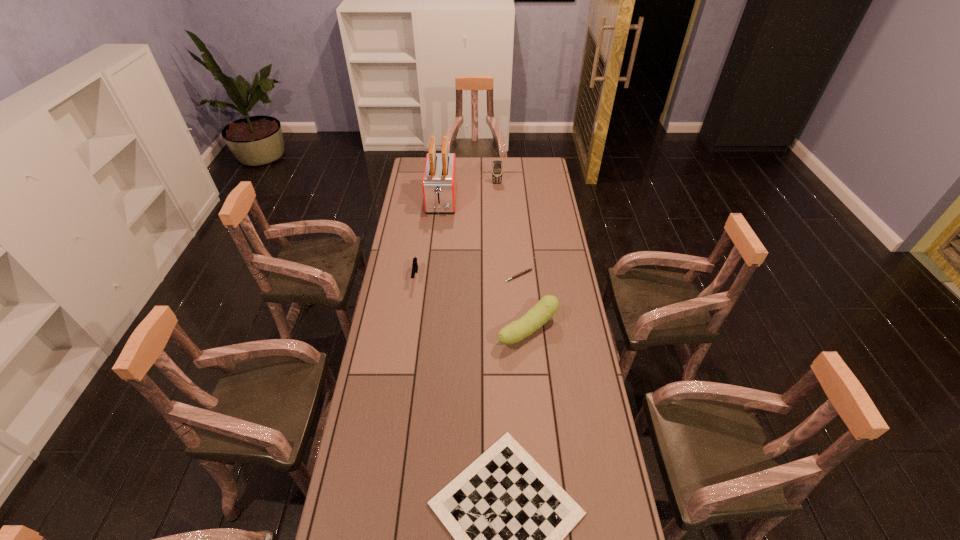
Image resolution: width=960 pixels, height=540 pixels. What are the coordinates of `empty location between the pen and the cucumber` in the screenshot? It's located at (523, 303).

Where is `free space between the toaster and the cellular telephone`? free space between the toaster and the cellular telephone is located at coordinates (469, 191).

Where is `vacant space that's between the third tallest object and the fourth tallest object`? vacant space that's between the third tallest object and the fourth tallest object is located at coordinates (471, 303).

Where is `free space between the second tallest object and the fourth shortest object`? free space between the second tallest object and the fourth shortest object is located at coordinates (513, 256).

Locate an element on the screen. Image resolution: width=960 pixels, height=540 pixels. vacant area that lies between the fifth farthest object and the third shortest object is located at coordinates (471, 303).

Locate an element on the screen. Image resolution: width=960 pixels, height=540 pixels. object that ranks as the fifth closest to the checkerboard is located at coordinates (497, 168).

I want to click on the fifth closest object to the cellular telephone, so (x=508, y=517).

The height and width of the screenshot is (540, 960). Find the location of `vacant space that satisfies the following two spatial constraints: 1. at the nib of the pen; 2. on the left side of the fourth shortest object`. vacant space that satisfies the following two spatial constraints: 1. at the nib of the pen; 2. on the left side of the fourth shortest object is located at coordinates (524, 330).

The image size is (960, 540). In order to click on free space that satisfies the following two spatial constraints: 1. on the front face of the second nearest object; 2. on the right side of the cellular telephone in this screenshot , I will do `click(504, 330)`.

You are a GUI agent. You are given a task and a screenshot of the screen. Output one action in this format:
    pyautogui.click(x=<x>, y=<y>)
    Task: Click on the blank space that satisfies the following two spatial constraints: 1. on the front face of the cellular telephone; 2. on the right side of the third tallest object
    Image resolution: width=960 pixels, height=540 pixels.
    Given the screenshot: What is the action you would take?
    pyautogui.click(x=504, y=330)